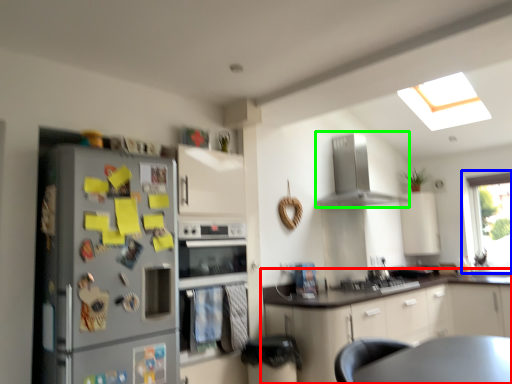
Question: Based on their relative distances, which object is nearer to cabinetry (highlighted by a red box)? Choose from window (highlighted by a blue box) and home appliance (highlighted by a green box).

Choices:
 (A) window
 (B) home appliance

Answer: (B)